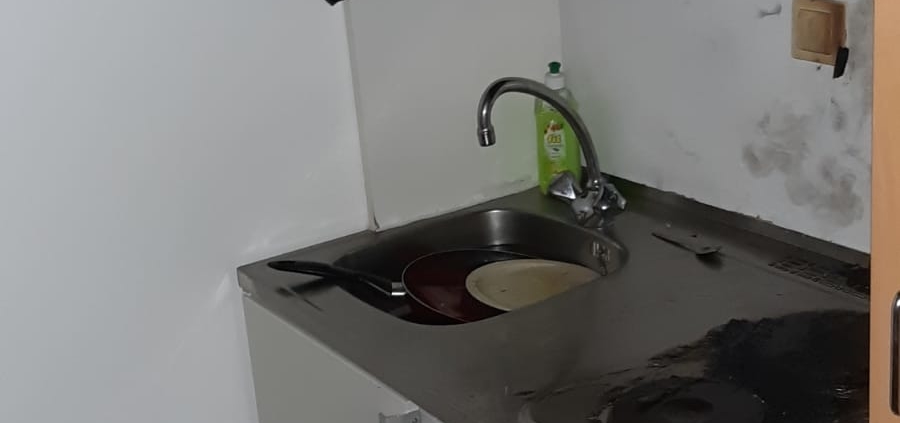
Locate an element on the screen. The image size is (900, 423). white wall is located at coordinates (256, 119).